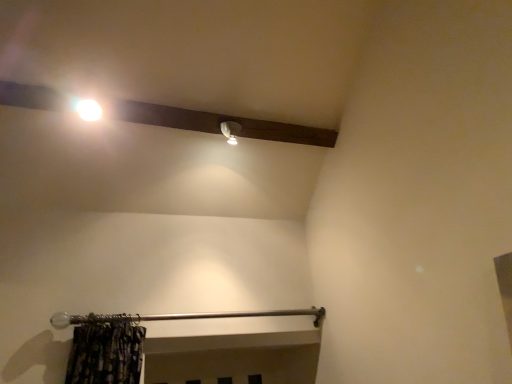
Question: Is silver/metallic curtain rod at lower center inside or outside of white glossy light bulb at upper left?

Choices:
 (A) inside
 (B) outside

Answer: (B)

Question: From a real-world perspective, relative to white glossy light bulb at upper left, is silver/metallic curtain rod at lower center vertically above or below?

Choices:
 (A) below
 (B) above

Answer: (A)

Question: Considering the relative positions of silver/metallic curtain rod at lower center and white glossy light bulb at upper left in the image provided, is silver/metallic curtain rod at lower center to the left or to the right of white glossy light bulb at upper left?

Choices:
 (A) left
 (B) right

Answer: (B)

Question: Is white glossy light bulb at upper left inside the boundaries of silver/metallic curtain rod at lower center, or outside?

Choices:
 (A) inside
 (B) outside

Answer: (B)

Question: In terms of size, does white glossy light bulb at upper left appear bigger or smaller than silver/metallic curtain rod at lower center?

Choices:
 (A) big
 (B) small

Answer: (B)

Question: From a real-world perspective, is white glossy light bulb at upper left positioned above or below silver/metallic curtain rod at lower center?

Choices:
 (A) above
 (B) below

Answer: (A)

Question: Does point (87, 107) appear closer or farther from the camera than point (242, 316)?

Choices:
 (A) closer
 (B) farther

Answer: (A)